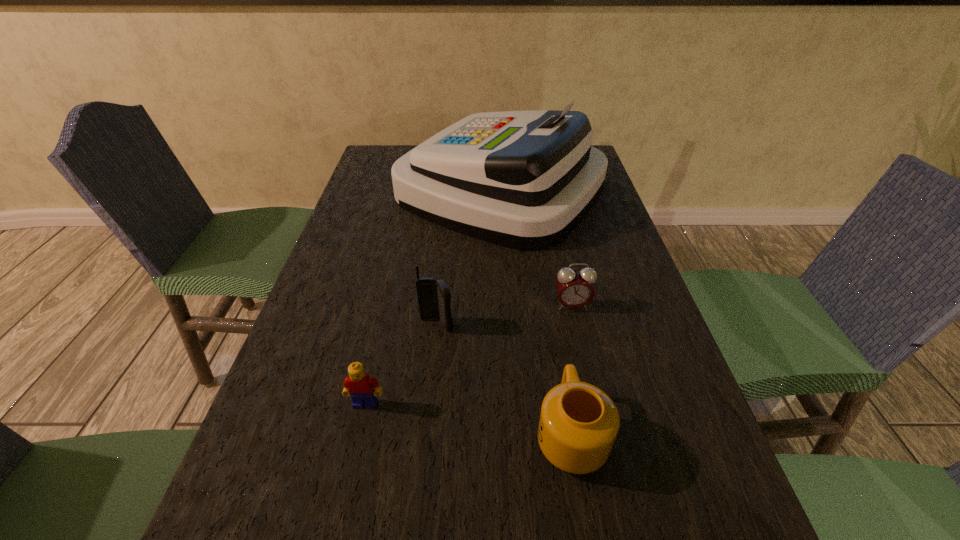
Locate an element on the screen. This screenshot has width=960, height=540. free space between the fourth nearest object and the third farthest object is located at coordinates (504, 315).

Identify the location of object that ranks as the fourth closest to the second farthest object. (359, 385).

Where is `object that is the second nearest to the farthest object`? object that is the second nearest to the farthest object is located at coordinates (434, 298).